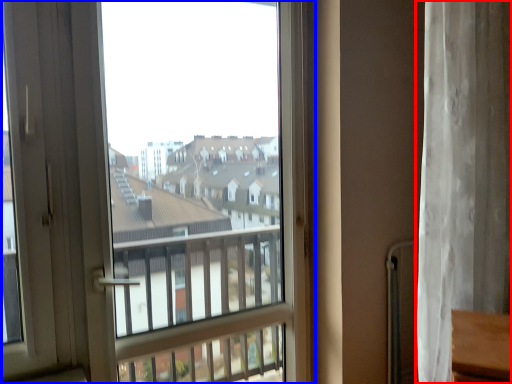
Question: Which object appears closest to the camera in this image, curtain (highlighted by a red box) or window (highlighted by a blue box)?

Choices:
 (A) curtain
 (B) window

Answer: (B)